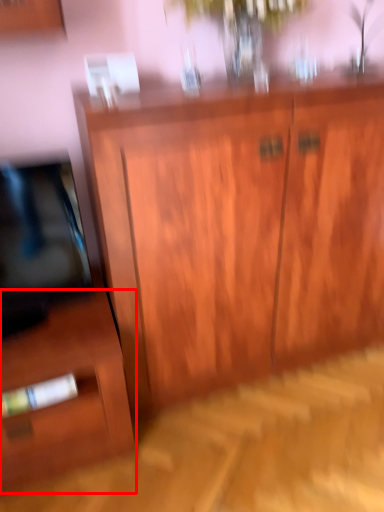
Question: In this image, where is side cabinet (annotated by the red box) located relative to cupboard?

Choices:
 (A) right
 (B) left

Answer: (B)